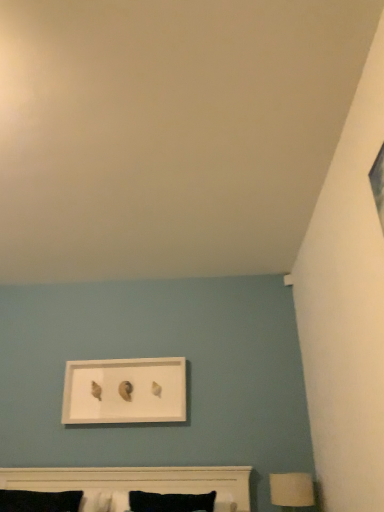
This screenshot has width=384, height=512. What are the coordinates of `empty space that is ontop of white matte picture frame at upper center (from a real-world perspective)` in the screenshot? It's located at (125, 358).